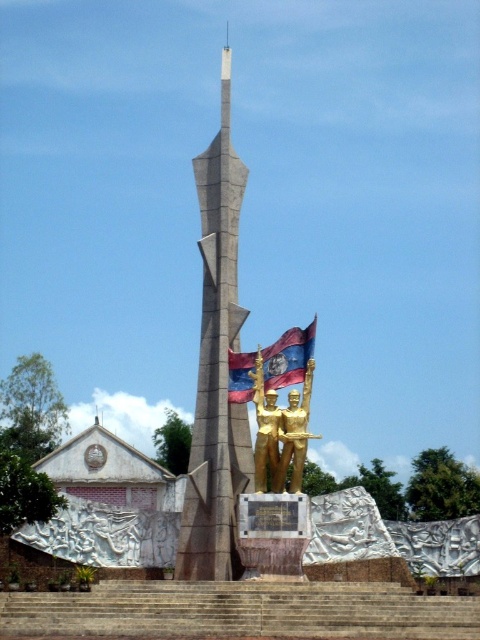
Is brown stone stairs at center to the left of gold metallic statue at center from the viewer's perspective?

Correct, you'll find brown stone stairs at center to the left of gold metallic statue at center.

Identify the location of brown stone stairs at center. The width and height of the screenshot is (480, 640). (241, 611).

Is point (237, 364) more distant than point (282, 481)?

Yes, point (237, 364) is behind point (282, 481).

Is red fabric flag at center in front of gold metallic statue at center?

No, red fabric flag at center is further to the viewer.

Is point (307, 337) less distant than point (296, 396)?

No, it is not.

Identify the location of red fabric flag at center. (288, 356).

Who is lower down, brown stone stairs at center or red fabric flag at center?

brown stone stairs at center

Describe the element at coordinates (241, 611) in the screenshot. I see `brown stone stairs at center` at that location.

What are the coordinates of `brown stone stairs at center` in the screenshot? It's located at (241, 611).